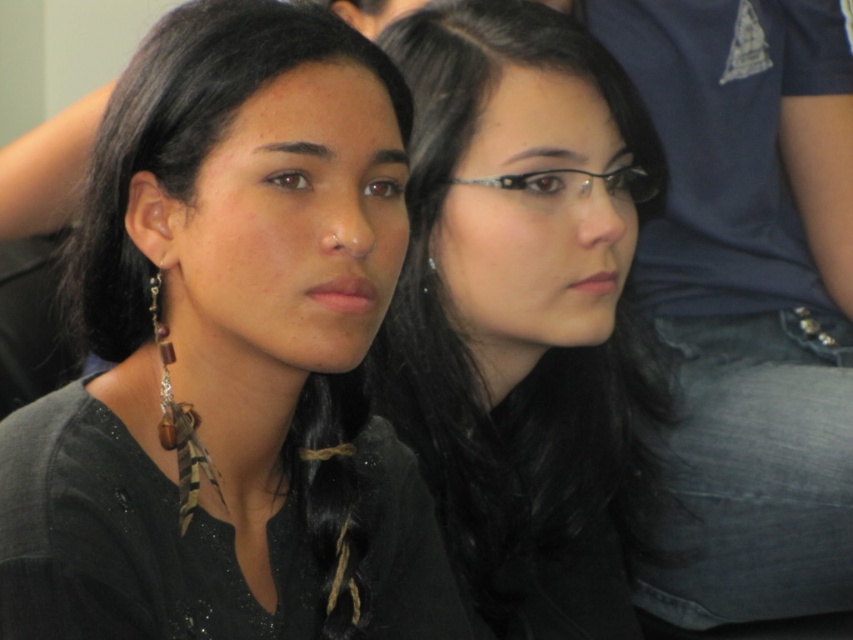
Question: Can you confirm if clear plastic glasses at center is positioned above brown feather earring at center?

Choices:
 (A) no
 (B) yes

Answer: (B)

Question: Which point is farther to the camera?

Choices:
 (A) black matte hair at center
 (B) black matte hair at upper left

Answer: (A)

Question: Does clear plastic glasses at center have a greater width compared to brown feather earring at center?

Choices:
 (A) yes
 (B) no

Answer: (A)

Question: Which object is positioned closest to the brown feather earring at center?

Choices:
 (A) black matte hair at upper right
 (B) black matte hair at upper left
 (C) clear plastic glasses at center
 (D) black matte hair at center

Answer: (C)

Question: Among these objects, which one is farthest from the camera?

Choices:
 (A) black matte hair at center
 (B) black matte hair at upper left

Answer: (A)

Question: Observing the image, what is the correct spatial positioning of clear plastic glasses at center in reference to brown feather earring at center?

Choices:
 (A) above
 (B) below

Answer: (A)